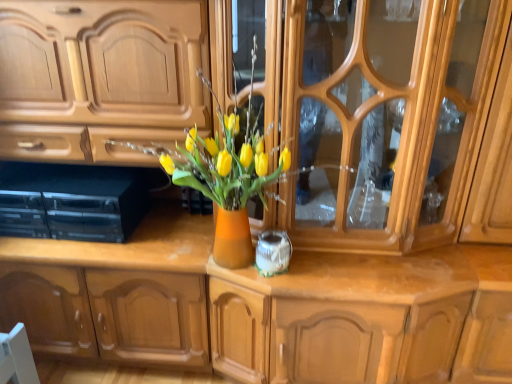
This screenshot has width=512, height=384. In order to click on black plastic stereo at lower left in this screenshot , I will do `click(72, 201)`.

The height and width of the screenshot is (384, 512). What do you see at coordinates (72, 201) in the screenshot?
I see `black plastic stereo at lower left` at bounding box center [72, 201].

Image resolution: width=512 pixels, height=384 pixels. Identify the location of black plastic stereo at lower left. (72, 201).